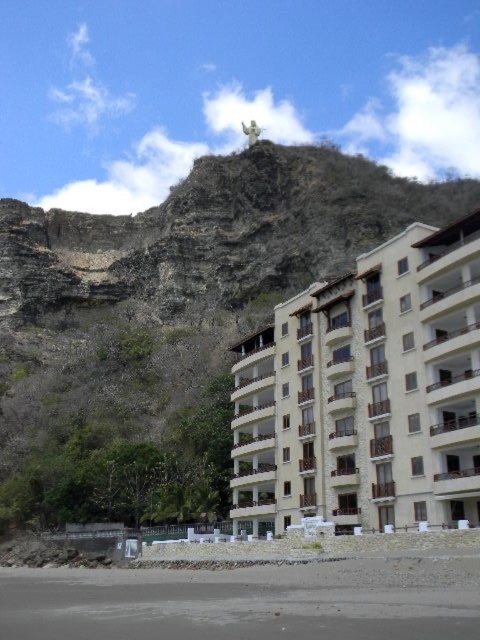
Who is taller, brown rocky mountain at upper center or beige stone building at center?

brown rocky mountain at upper center is taller.

Does brown rocky mountain at upper center have a smaller size compared to beige stone building at center?

No, brown rocky mountain at upper center is not smaller than beige stone building at center.

Is point (44, 513) positioned in front of point (335, 468)?

No, it is behind (335, 468).

Locate an element on the screen. brown rocky mountain at upper center is located at coordinates (168, 314).